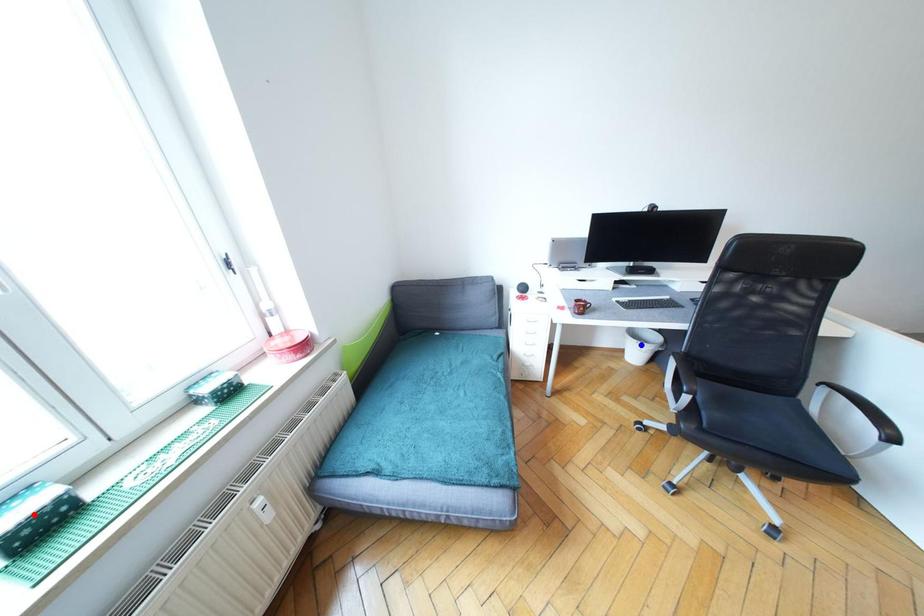
Question: Two points are marked on the image. Which point is closer to the camera?

Choices:
 (A) Blue point is closer.
 (B) Red point is closer.

Answer: (B)